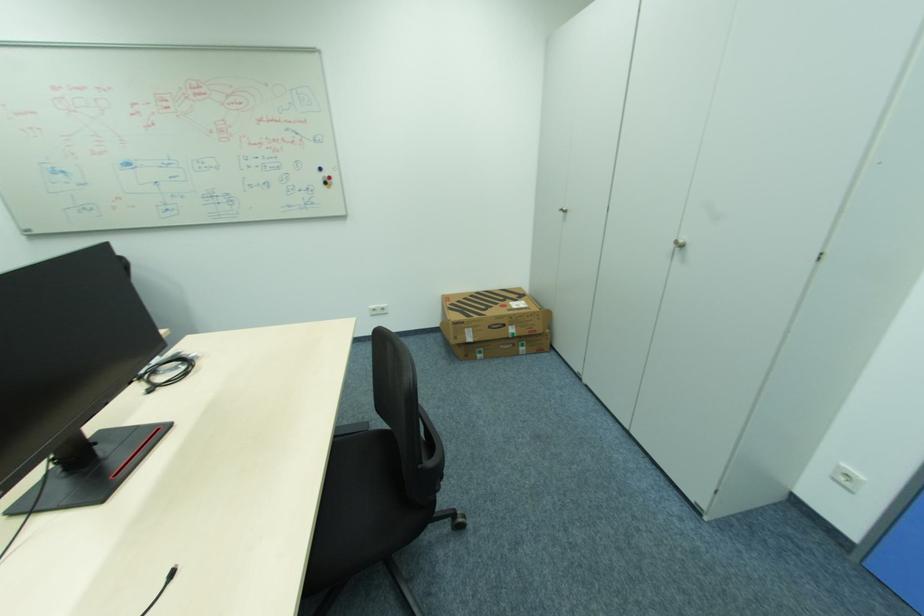
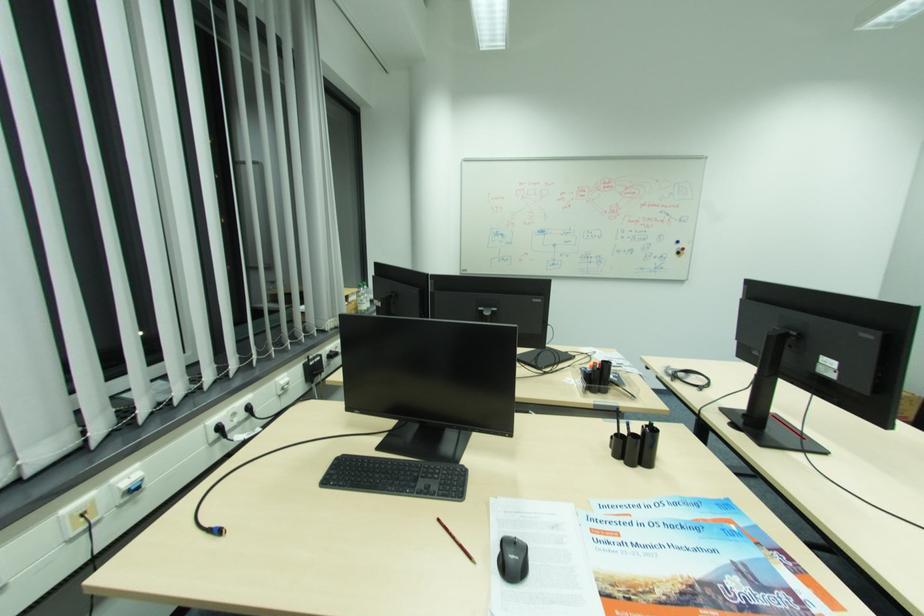
Where in the second image is the point corresponding to pixel 331 184 from the first image?

(684, 253)